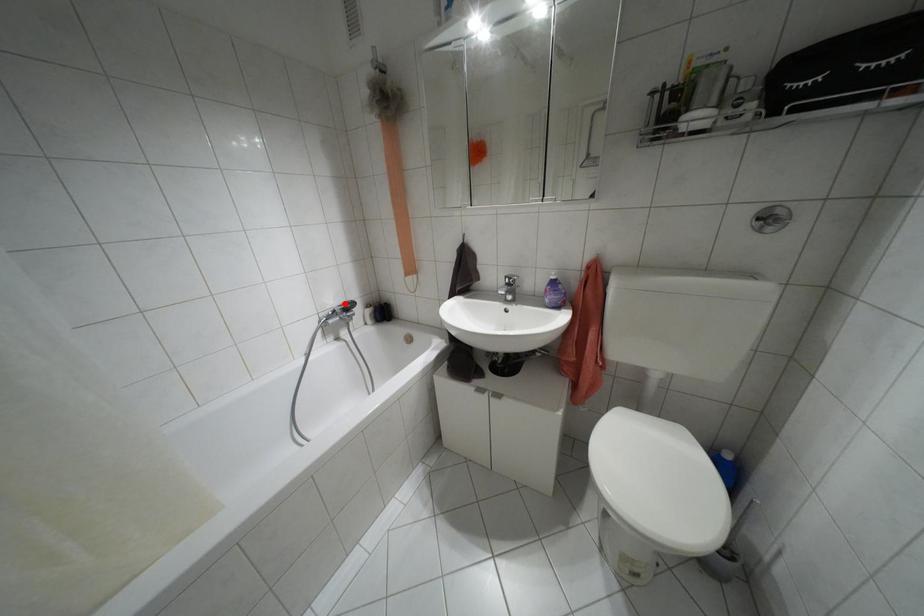
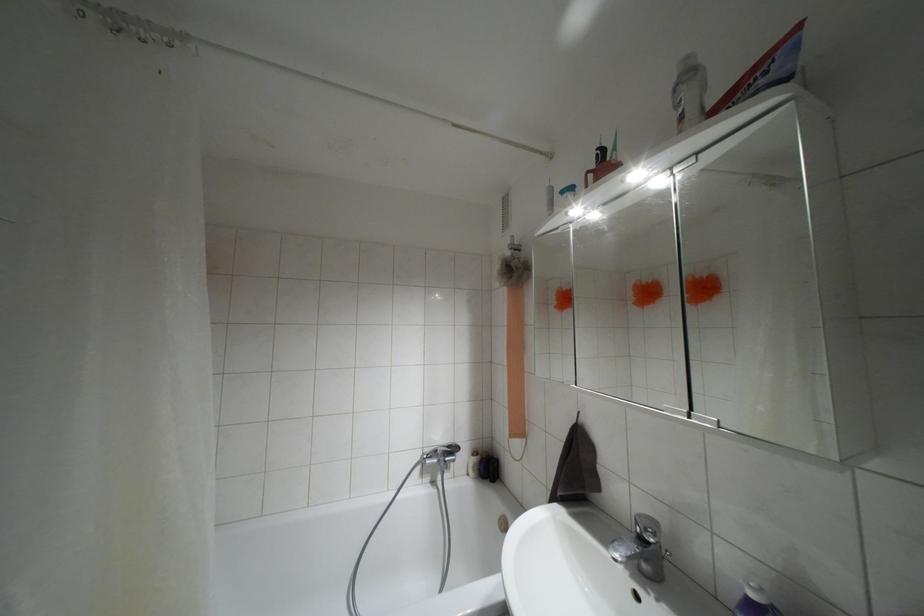
Find the pixel in the second image that matches the highlighted location in the first image.

(447, 446)